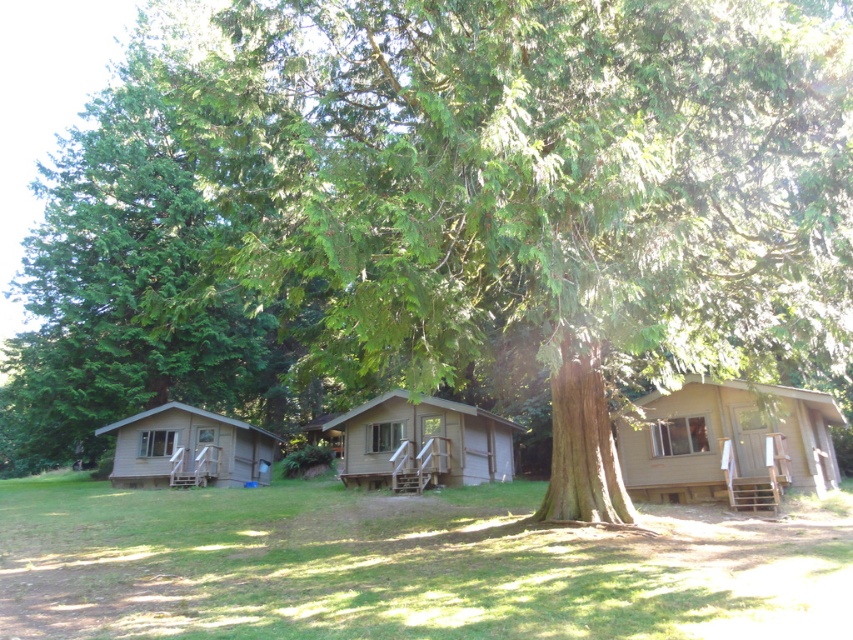
You are standing at the entrance of the brown wood cabin at center and want to see the green textured tree at left. Can you see the entire tree without moving your position?

Yes, the green textured tree at left is in front of the brown wood cabin at center, so you can see the entire tree from your position at the cabin entrance without needing to move.

You are standing at the center of the image and want to place a small garden. Which direction should you walk to reach the green grass at lower center?

You should walk downward and toward the center to reach the green grass at lower center, as it is located at point coordinates of 0.886 on the x and 0.469 on the y axis.